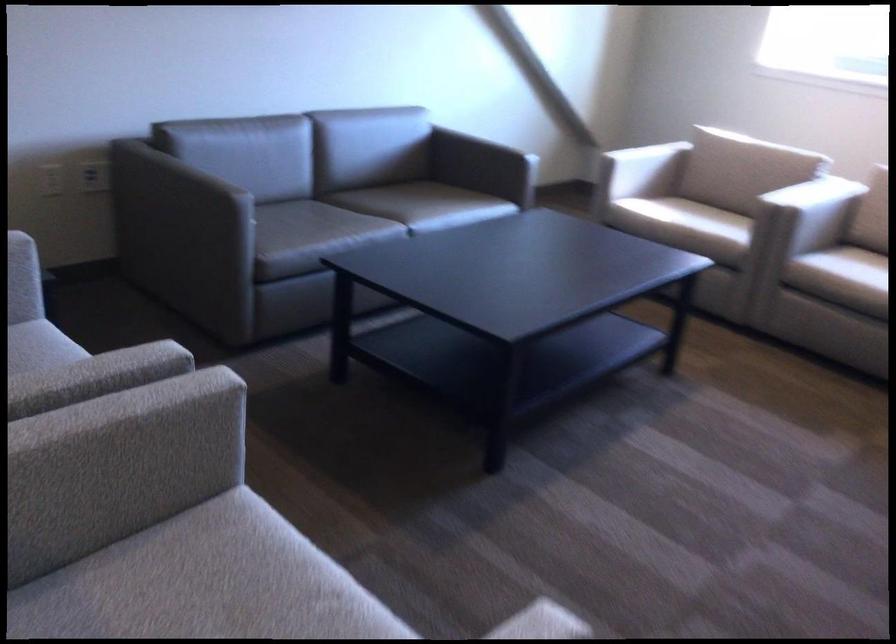
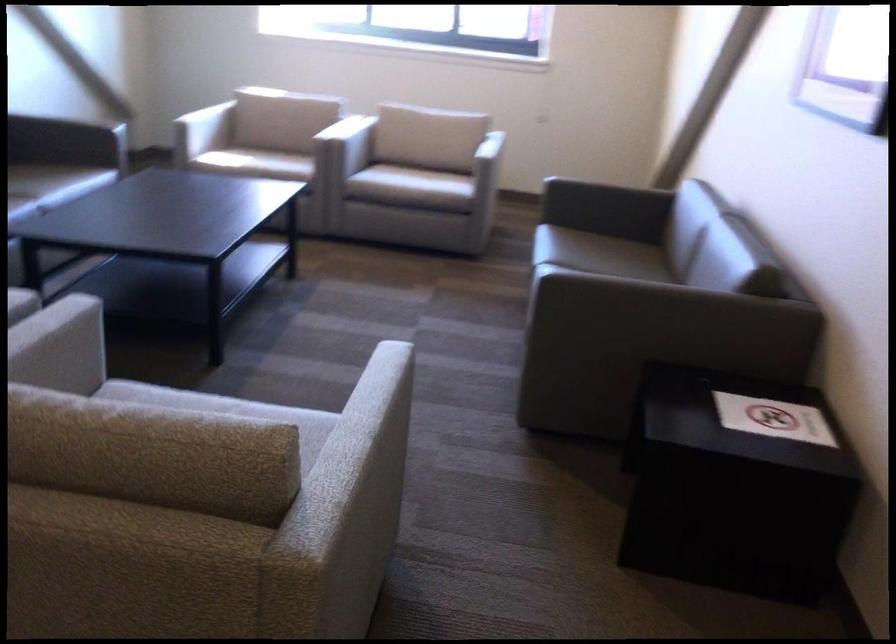
Locate, in the second image, the point that corresponds to point (642, 184) in the first image.

(202, 131)